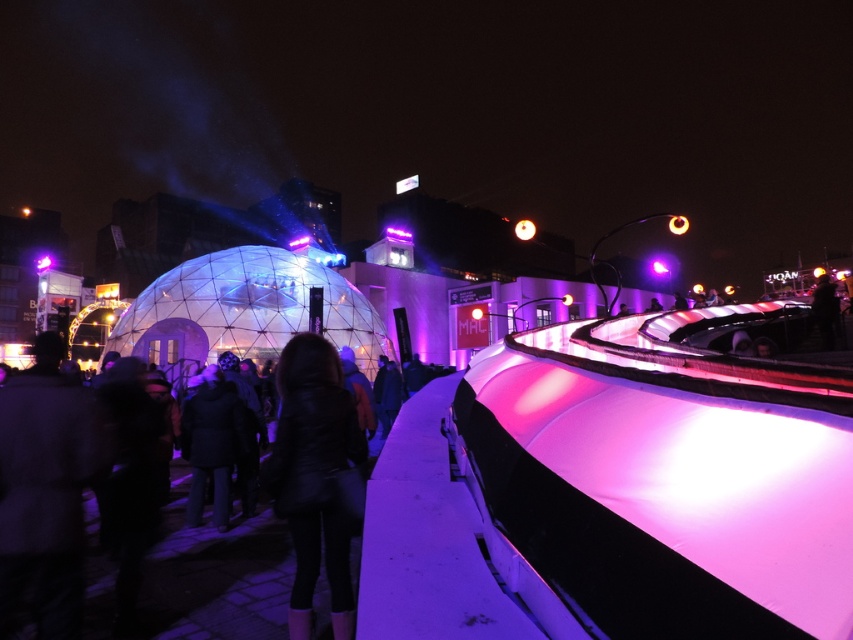
Question: Is black leather jacket at center in front of metallic sphere at center?

Choices:
 (A) yes
 (B) no

Answer: (A)

Question: Does black leather jacket at center come in front of metallic sphere at center?

Choices:
 (A) yes
 (B) no

Answer: (A)

Question: Which point is farther from the camera taking this photo?

Choices:
 (A) (526, 230)
 (B) (289, 547)
 (C) (317, 468)

Answer: (A)

Question: Which point appears farthest from the camera in this image?

Choices:
 (A) (531, 220)
 (B) (299, 465)
 (C) (206, 515)

Answer: (A)

Question: Which point appears closest to the camera in this image?

Choices:
 (A) (352, 611)
 (B) (286, 579)

Answer: (A)

Question: Can you confirm if leather jacket at center is positioned above black leather jacket at center?

Choices:
 (A) yes
 (B) no

Answer: (B)